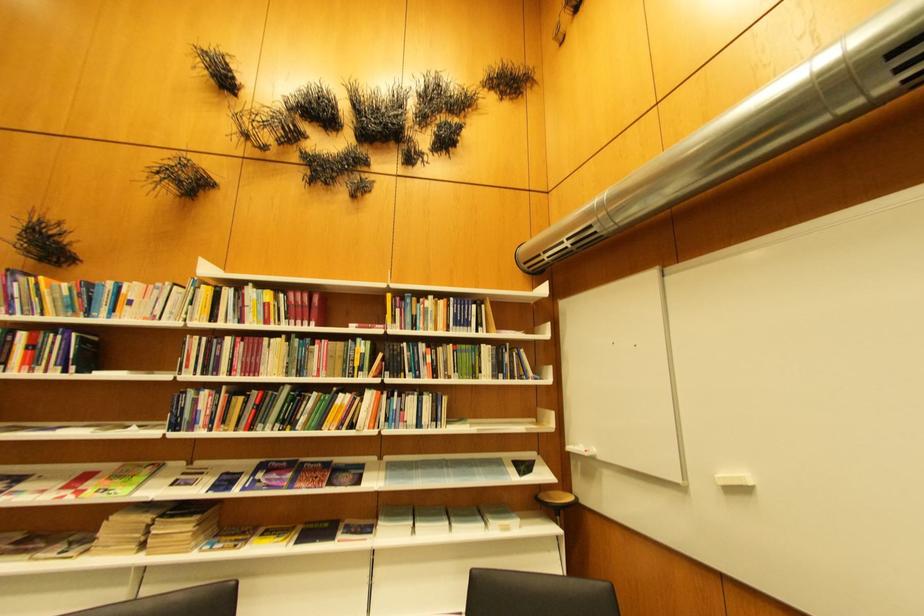
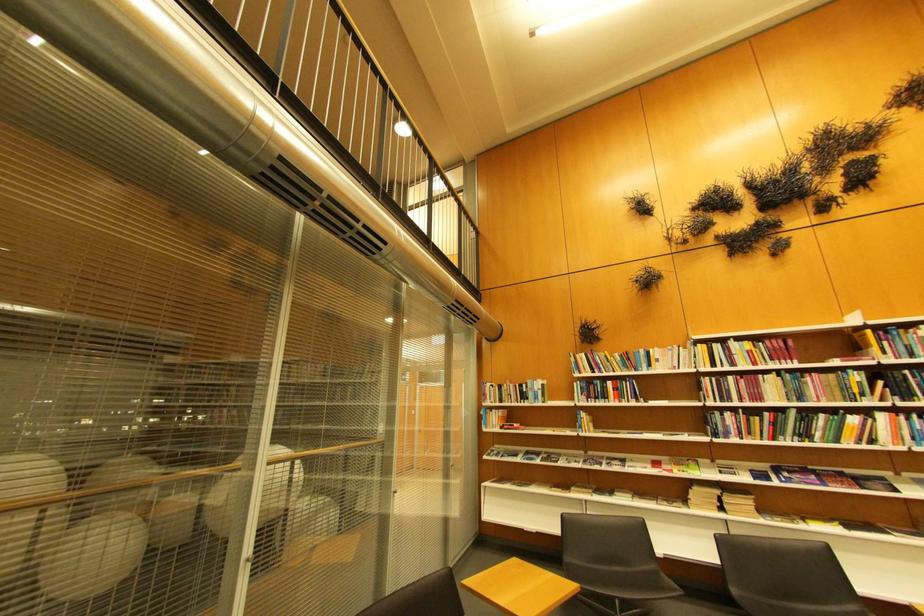
Locate, in the second image, the point that corresponds to (115,310) in the first image.

(654, 368)